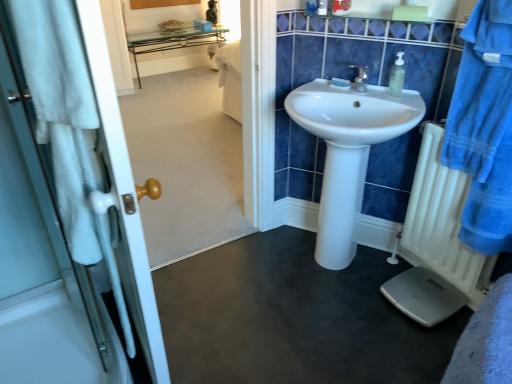
Locate an element on the screen. free location in front of white glossy sink at center is located at coordinates (334, 331).